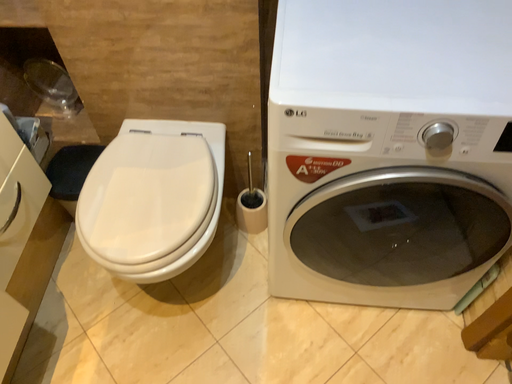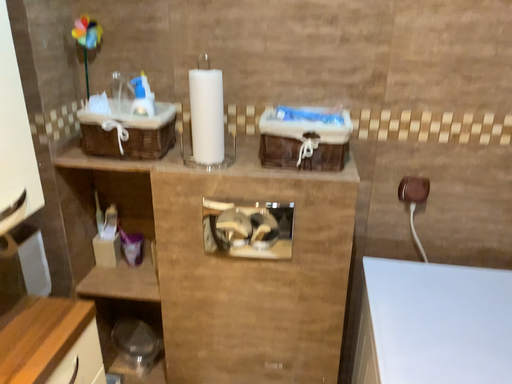
Question: How did the camera likely rotate when shooting the video?

Choices:
 (A) rotated upward
 (B) rotated downward

Answer: (A)